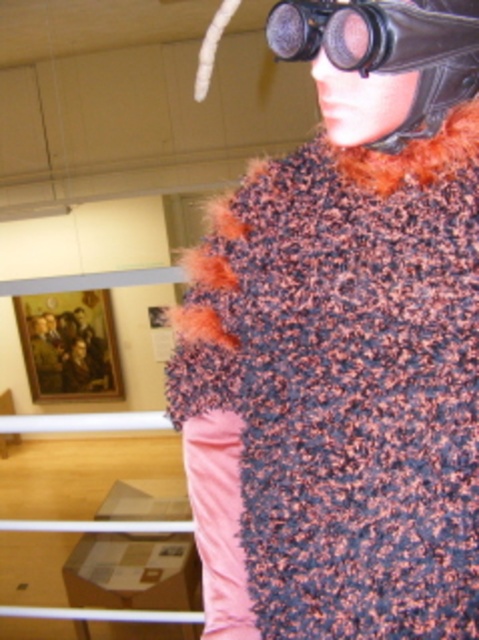
Question: Can you confirm if fuzzy multicolored scarf at upper center is positioned above black leather goggles at upper center?

Choices:
 (A) yes
 (B) no

Answer: (B)

Question: Which point is farther to the camera?

Choices:
 (A) (274, 42)
 (B) (345, 164)

Answer: (B)

Question: Can you confirm if fuzzy multicolored scarf at upper center is thinner than black leather goggles at upper center?

Choices:
 (A) yes
 (B) no

Answer: (B)

Question: Is fuzzy multicolored scarf at upper center positioned before black leather goggles at upper center?

Choices:
 (A) yes
 (B) no

Answer: (B)

Question: Which point is farther from the camera taking this photo?

Choices:
 (A) (409, 589)
 (B) (353, 38)

Answer: (A)